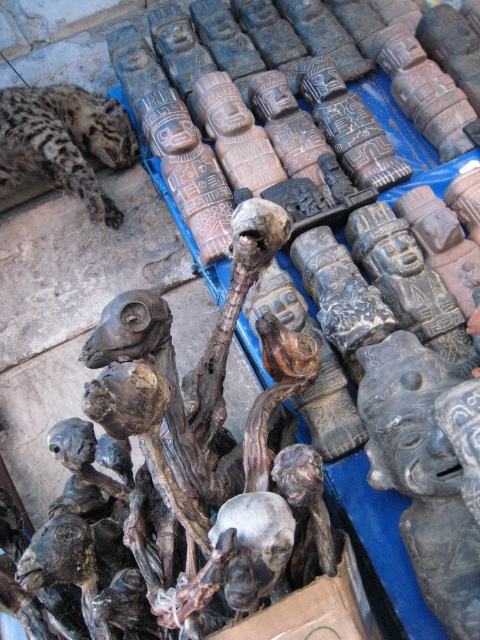
Can you confirm if brown wood skull at center is taller than spotted fur cheetah at upper left?

Yes.

Between point (203, 408) and point (12, 108), which one is positioned behind?

Point (12, 108)

What do you see at coordinates (176, 474) in the screenshot? I see `brown wood skull at center` at bounding box center [176, 474].

Where is `brown wood skull at center`? Image resolution: width=480 pixels, height=640 pixels. brown wood skull at center is located at coordinates (176, 474).